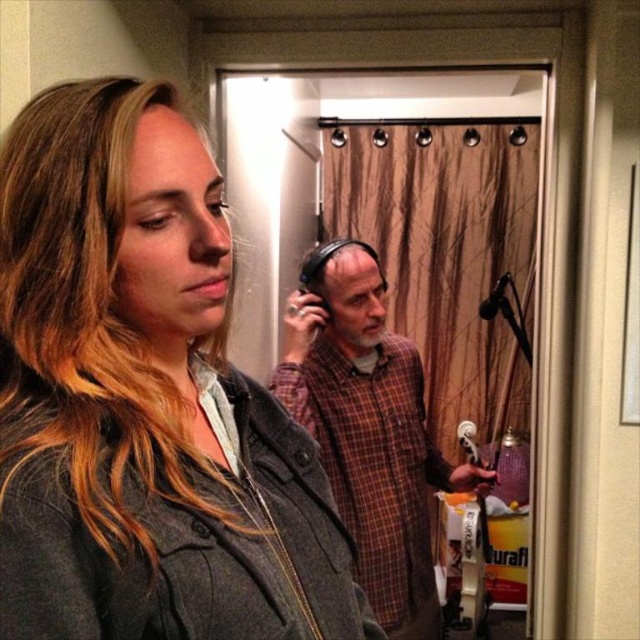
Question: Observing the image, what is the correct spatial positioning of matte gray jacket at center in reference to plaid fabric shirt at center?

Choices:
 (A) above
 (B) below

Answer: (A)

Question: Which point is farther to the camera?

Choices:
 (A) (120, 81)
 (B) (404, 605)

Answer: (B)

Question: Is matte gray jacket at center smaller than plaid fabric shirt at center?

Choices:
 (A) yes
 (B) no

Answer: (A)

Question: Which of the following is the closest to the observer?

Choices:
 (A) plaid fabric shirt at center
 (B) matte gray jacket at center

Answer: (B)

Question: Is matte gray jacket at center positioned before plaid fabric shirt at center?

Choices:
 (A) no
 (B) yes

Answer: (B)